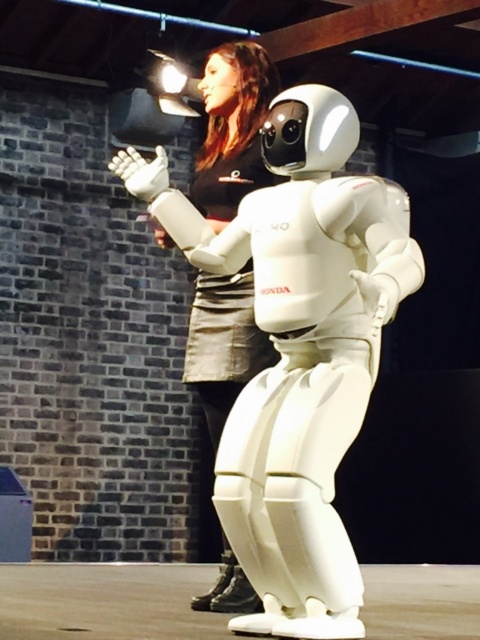
Who is taller, matte black dress at upper center or black matte dress at center?

matte black dress at upper center

Can you confirm if matte black dress at upper center is bigger than black matte dress at center?

Yes.

Which is behind, point (244, 154) or point (242, 307)?

The point (244, 154) is behind.

Find the location of a particular element. matte black dress at upper center is located at coordinates (231, 129).